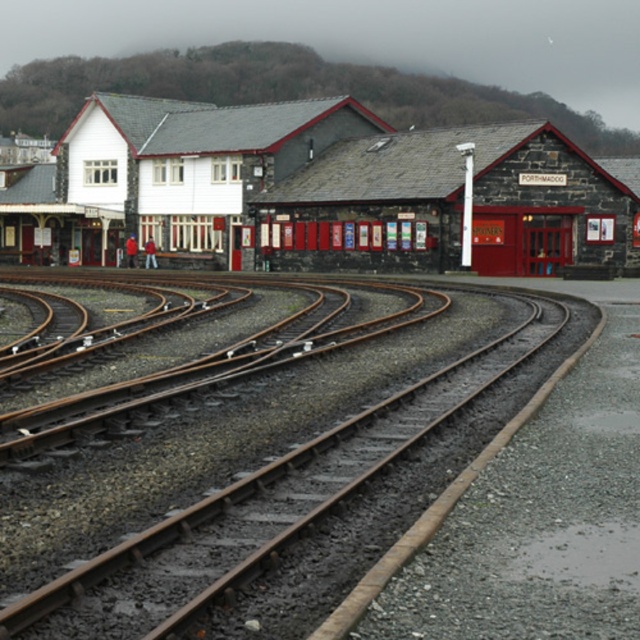
You are a passenger waiting at the stone brick railway station at center and want to board a train on the brown metallic tracks at center. Which direction should you walk to reach the tracks?

The stone brick railway station at center is to the left of brown metallic tracks at center, so you should walk to your right to reach the tracks.

You are standing at the railway station and want to know how far the stone brick railway station at center is from your current position. Can you determine the distance?

The stone brick railway station at center is 128.31 feet away from the viewer.

You are standing at the entrance of the railway station and want to take a photo of the stone brick railway station at center from a specific coordinate point. What are the coordinates where you should position yourself to capture the entire building in your shot?

The stone brick railway station at center is located at coordinates point (x=324, y=192). Position yourself at a distance that allows your camera to frame the entire building from that central point.